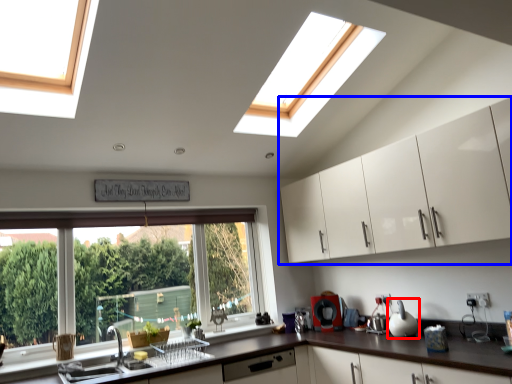
Question: Which object is further to the camera taking this photo, appliance (highlighted by a red box) or cabinetry (highlighted by a blue box)?

Choices:
 (A) appliance
 (B) cabinetry

Answer: (A)